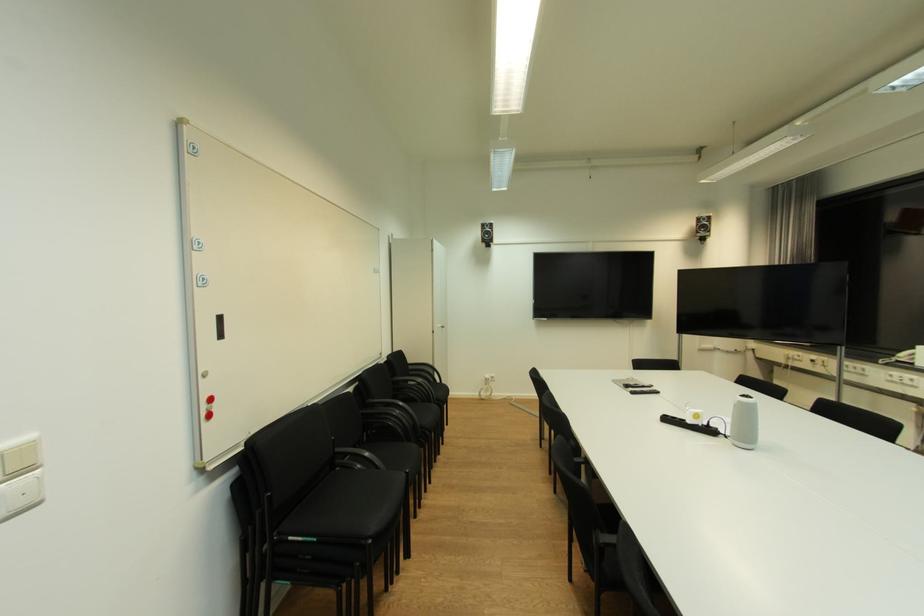
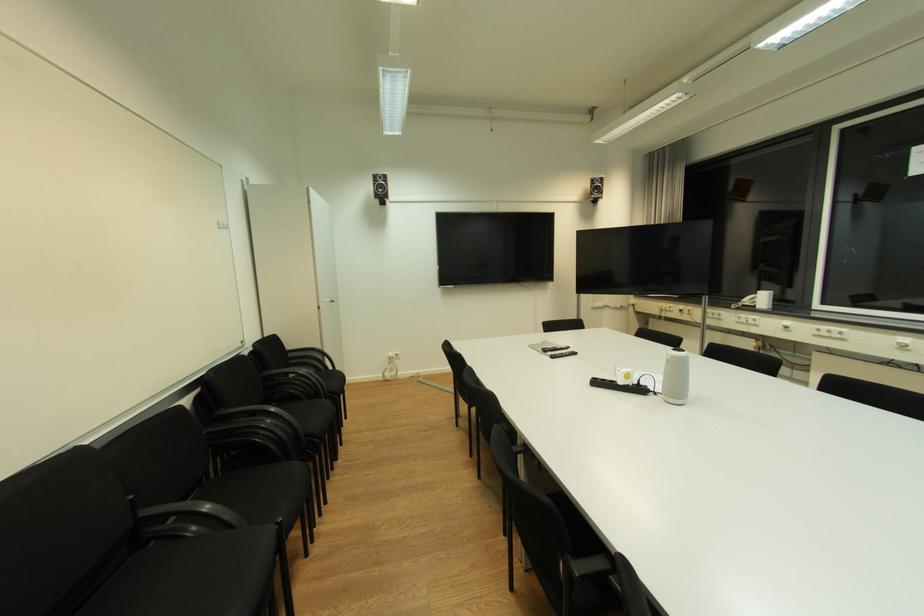
The point at (x=714, y=423) is marked in the first image. Where is the corresponding point in the second image?

(645, 381)